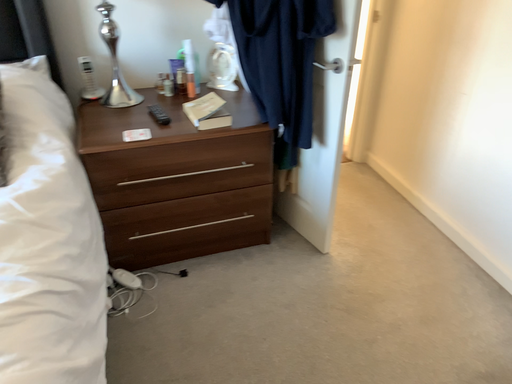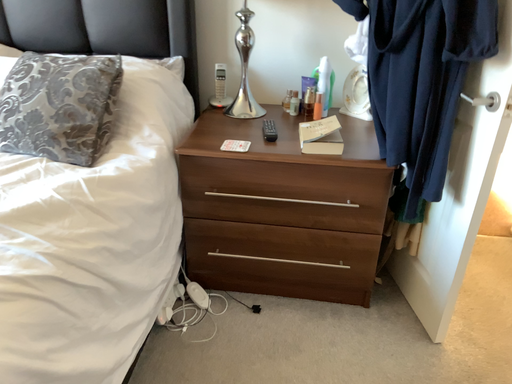
Question: How did the camera likely rotate when shooting the video?

Choices:
 (A) rotated upward
 (B) rotated downward

Answer: (A)